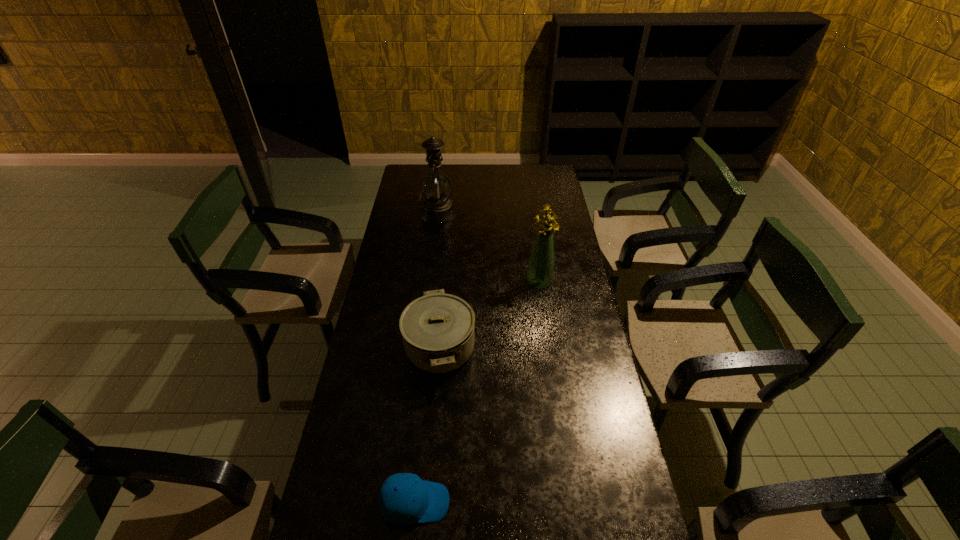
At what (x,y) coordinates should I click in order to perform the action: click on vacant space located on the front-facing side of the cap. Please return your answer as a coordinate pair (x, y). The width and height of the screenshot is (960, 540). Looking at the image, I should click on (509, 502).

Find the location of `oil lamp that is at the left edge`. oil lamp that is at the left edge is located at coordinates point(436,188).

Locate an element on the screen. saucepan at the left edge is located at coordinates (437, 329).

This screenshot has height=540, width=960. What are the coordinates of `cap at the left edge` in the screenshot? It's located at (404, 498).

Locate an element on the screen. Image resolution: width=960 pixels, height=540 pixels. object that is positioned at the right edge is located at coordinates (x=540, y=271).

What are the coordinates of `vacant space at the far edge` in the screenshot? It's located at (492, 170).

Locate an element on the screen. Image resolution: width=960 pixels, height=540 pixels. free space at the left edge of the desktop is located at coordinates (362, 375).

This screenshot has width=960, height=540. I want to click on free space at the right edge, so click(x=562, y=268).

Identify the location of free space at the far left corner of the desktop. (415, 177).

At what (x,y) coordinates should I click in order to perform the action: click on vacant area at the far right corner of the desktop. Please return your answer as a coordinate pair (x, y). The image size is (960, 540). Looking at the image, I should click on (554, 166).